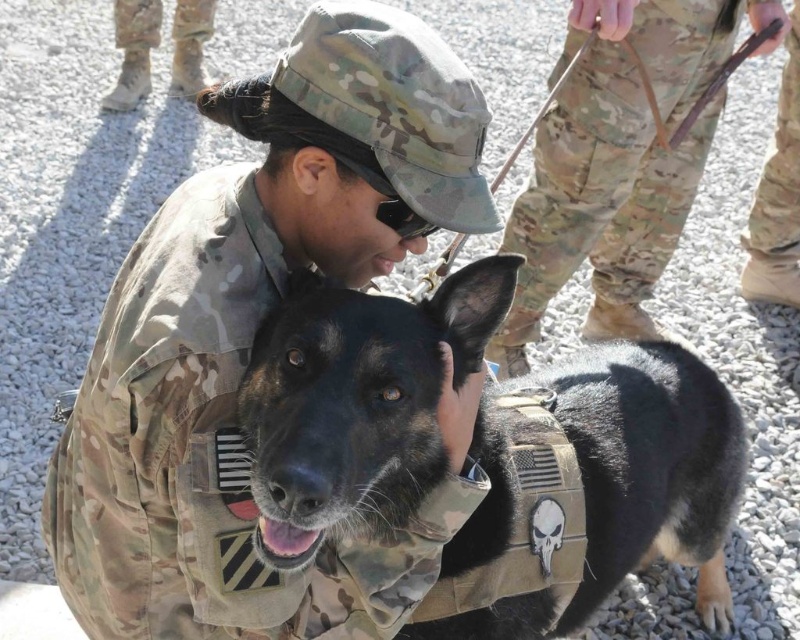
Who is lower down, camouflage uniform at center or camouflage pants at center?

camouflage uniform at center is lower down.

Between camouflage uniform at center and camouflage pants at center, which one has more height?

camouflage pants at center is taller.

This screenshot has width=800, height=640. I want to click on camouflage uniform at center, so coord(252,340).

At what (x,y) coordinates should I click in order to perform the action: click on camouflage uniform at center. Please return your answer as a coordinate pair (x, y). The image size is (800, 640). Looking at the image, I should click on (252, 340).

Can you confirm if camouflage uniform at center is wider than black matte vest at center?

In fact, camouflage uniform at center might be narrower than black matte vest at center.

Consider the image. Between camouflage uniform at center and black matte vest at center, which one is positioned lower?

black matte vest at center is lower down.

Is point (210, 474) positioned in front of point (509, 500)?

Yes, it is in front of point (509, 500).

Locate an element on the screen. This screenshot has height=640, width=800. camouflage uniform at center is located at coordinates (252, 340).

Is camouflage pants at center positioned behind camouflage boots at lower left?

No.

Which is in front, point (672, 54) or point (176, 86)?

Positioned in front is point (672, 54).

Image resolution: width=800 pixels, height=640 pixels. What are the coordinates of `camouflage pants at center` in the screenshot? It's located at (618, 161).